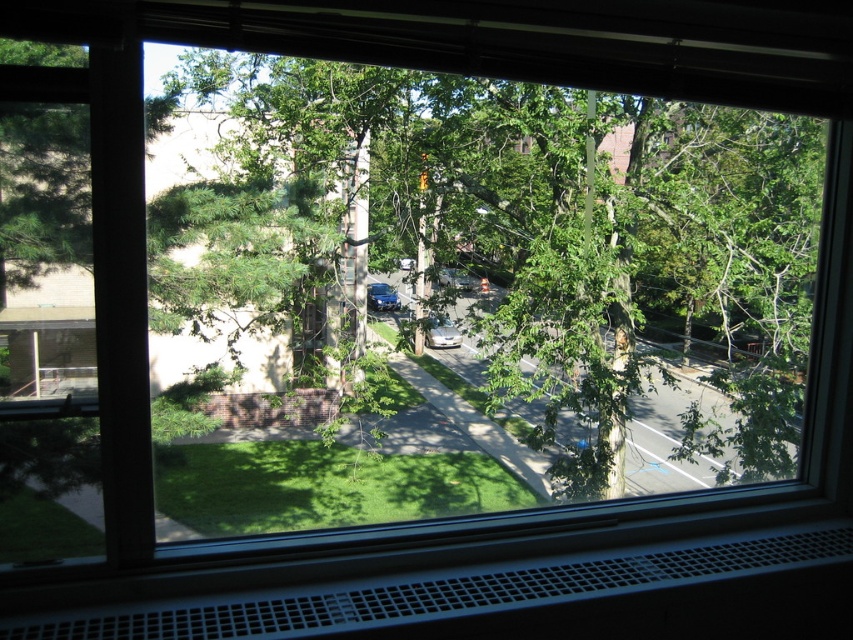
You are standing in a room and looking through the window. There is a silver metallic car at center. Based on the window frame and the position of the car, can you determine if the car is parked on the same side of the street as the building or the opposite side?

The silver metallic car at center is located at point (440, 332), which is in the central part of the window frame. Since the window has a vent structure at the bottom, which is part of an air conditioning unit, it suggests the building is on one side of the street. The car being centrally positioned might indicate it is on the same side as the building, but without more details on street layout, this is speculative. However, based on the given coordinates, the car is directly in front of the window, soit